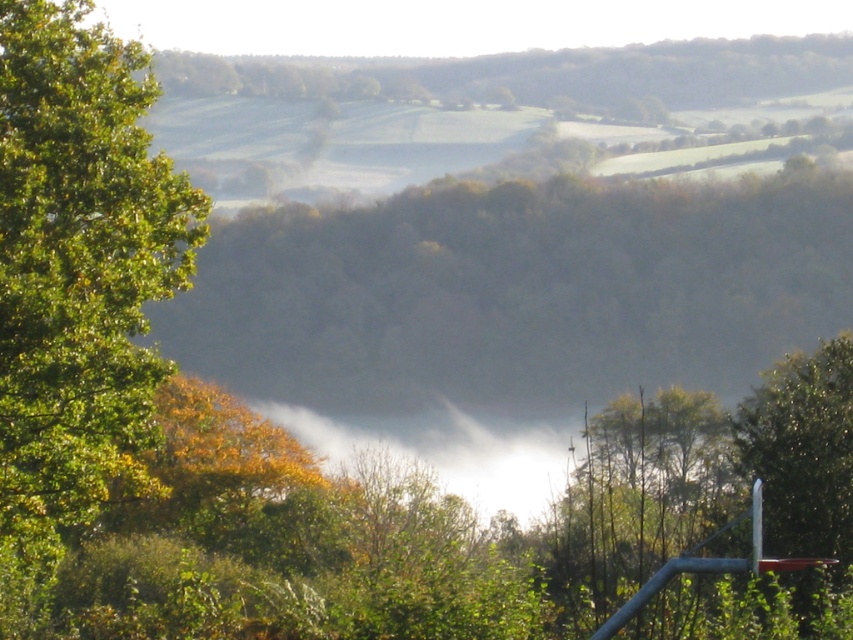
You are a bird looking for a higher perch. You see a green leafy tree at center and a green leafy tree at left. Which tree should you choose to get a better view?

The green leafy tree at center is taller than the green leafy tree at left, so you should choose the green leafy tree at center to get a better view.

You are standing in the rural landscape and want to take a photo of the green leafy tree at center and the green leafy tree at left. Which tree should you focus on if you want to capture the wider tree in your shot?

The green leafy tree at center might be wider than the green leafy tree at left, so you should focus on the green leafy tree at center to capture the wider tree in your shot.